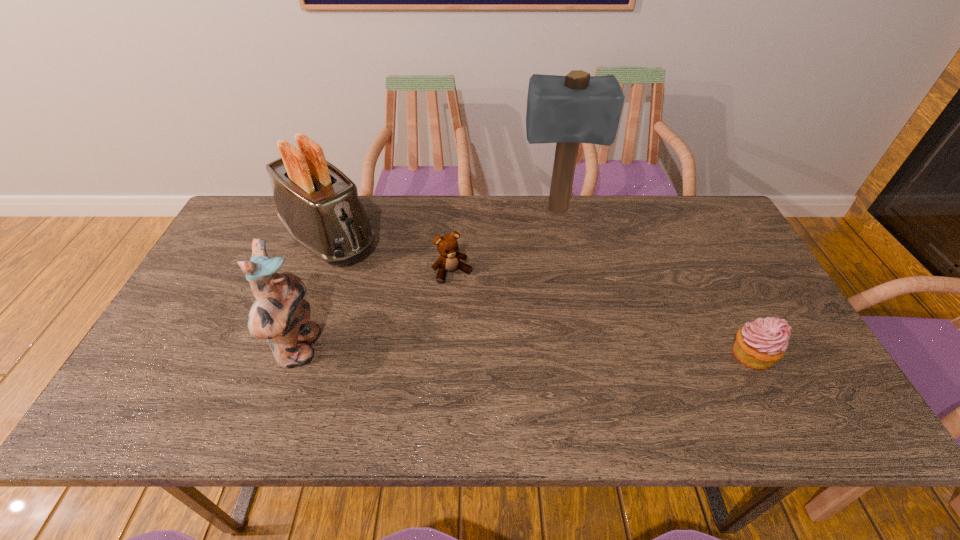
This screenshot has width=960, height=540. Identify the location of cupcake that is at the near edge. (759, 344).

Find the location of a particular element. object that is at the right edge is located at coordinates (759, 344).

Locate an element on the screen. This screenshot has height=540, width=960. object positioned at the near right corner is located at coordinates (759, 344).

The width and height of the screenshot is (960, 540). In the image, there is a desktop. In order to click on vacant area at the far edge in this screenshot , I will do `click(428, 198)`.

What are the coordinates of `blank space at the near edge of the desktop` in the screenshot? It's located at (320, 373).

Identify the location of vacant space at the left edge of the desktop. (184, 334).

In the image, there is a desktop. Where is `vacant space at the right edge`? The image size is (960, 540). vacant space at the right edge is located at coordinates (740, 253).

The image size is (960, 540). In order to click on vacant space at the far left corner of the desktop in this screenshot , I will do `click(240, 219)`.

At what (x,y) coordinates should I click in order to perform the action: click on free location at the far right corner of the desktop. Please return your answer as a coordinate pair (x, y). The width and height of the screenshot is (960, 540). Looking at the image, I should click on (702, 241).

Locate an element on the screen. blank space at the near right corner is located at coordinates (827, 388).